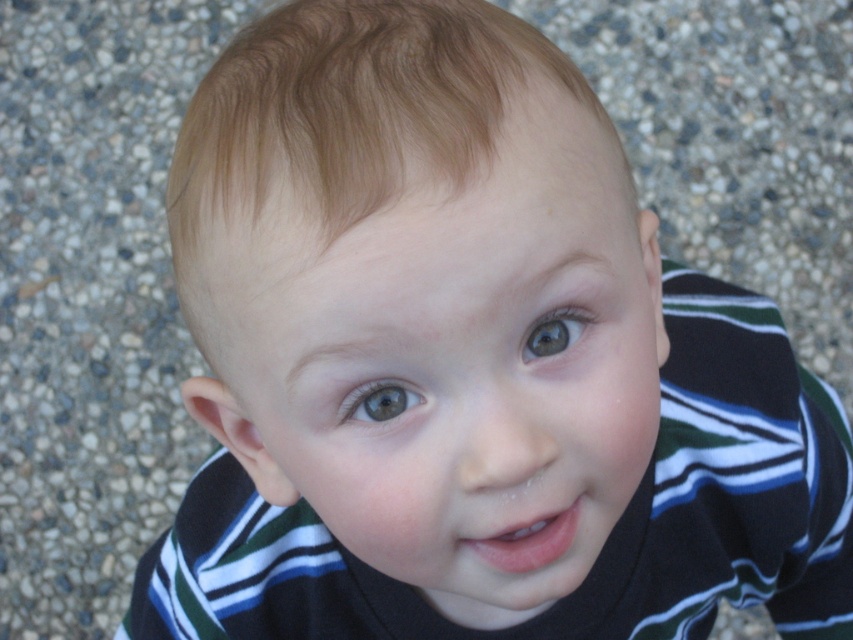
Does point (550, 310) come closer to viewer compared to point (347, 419)?

Yes, it is in front of point (347, 419).

Is point (576, 333) positioned after point (404, 387)?

Yes, it is behind point (404, 387).

This screenshot has height=640, width=853. I want to click on green matte eye at center, so click(554, 332).